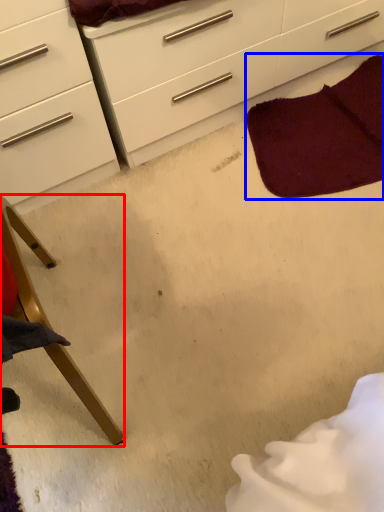
Question: Which object appears farthest to the camera in this image, furniture (highlighted by a red box) or blanket (highlighted by a blue box)?

Choices:
 (A) furniture
 (B) blanket

Answer: (B)